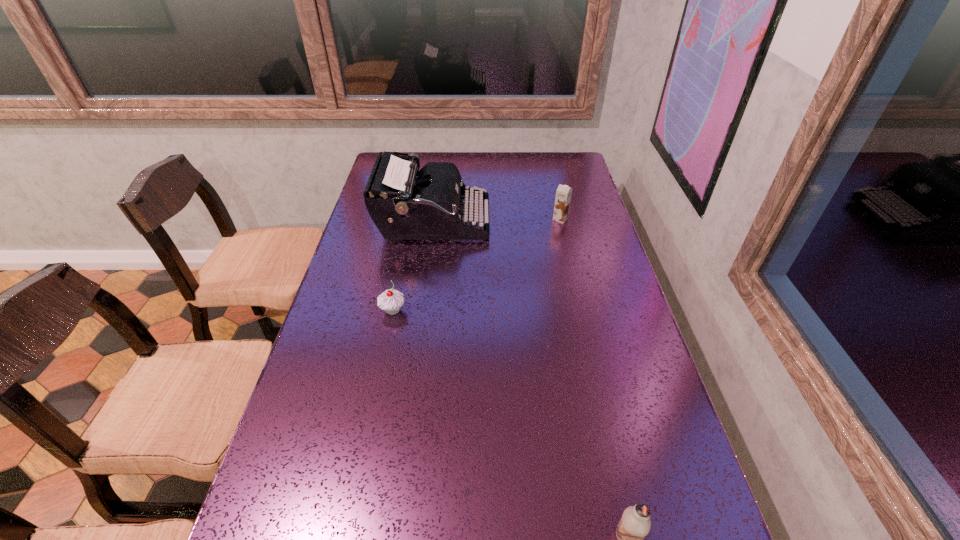
The image size is (960, 540). What are the coordinates of `vacant space that satisfies the following two spatial constraints: 1. on the back side of the farther chocolate milk; 2. on the left side of the third farthest object` in the screenshot? It's located at (412, 219).

Find the location of `free space that satisfies the following two spatial constraints: 1. on the back side of the farther chocolate milk; 2. on the right side of the third farthest object`. free space that satisfies the following two spatial constraints: 1. on the back side of the farther chocolate milk; 2. on the right side of the third farthest object is located at coordinates (412, 219).

The height and width of the screenshot is (540, 960). Find the location of `vacant space that satisfies the following two spatial constraints: 1. on the front side of the farther chocolate milk; 2. on the typing side of the tallest object`. vacant space that satisfies the following two spatial constraints: 1. on the front side of the farther chocolate milk; 2. on the typing side of the tallest object is located at coordinates (561, 222).

The height and width of the screenshot is (540, 960). I want to click on vacant space that satisfies the following two spatial constraints: 1. on the typing side of the typewriter; 2. on the front side of the cupcake, so click(420, 310).